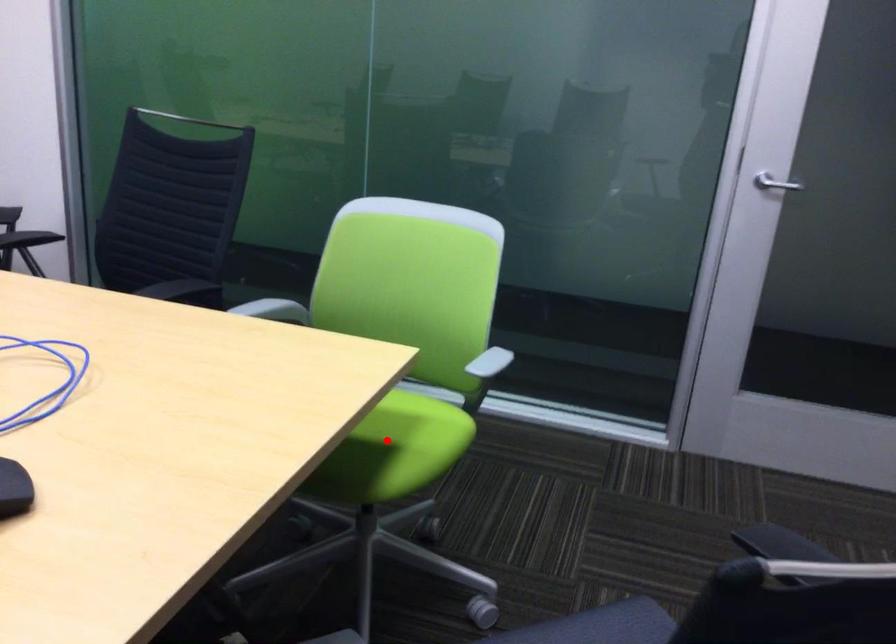
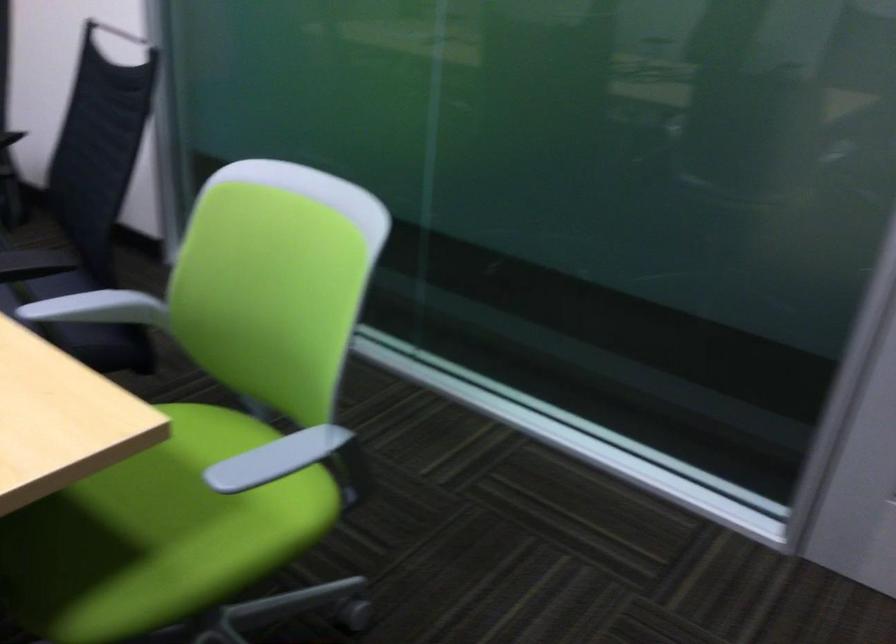
Question: I am providing you with two images of the same scene from different viewpoints. Image1 has a red point marked. In image2, the corresponding 3D location appears at what relative position? Reply with the corresponding letter.

Choices:
 (A) Closer
 (B) Farther

Answer: (A)